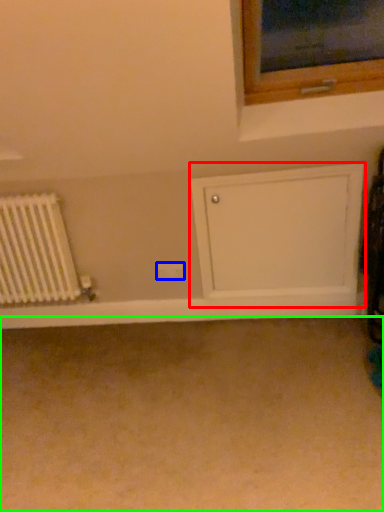
Question: Estimate the real-world distances between objects in this image. Which object is farther from shelf (highlighted by a red box), electric outlet (highlighted by a blue box) or plain (highlighted by a green box)?

Choices:
 (A) electric outlet
 (B) plain

Answer: (B)